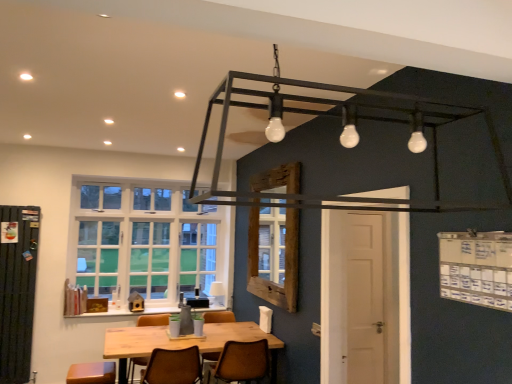
Measure the distance between point (x=509, y=196) and camera.

A distance of 5.02 feet exists between point (x=509, y=196) and camera.

You are a GUI agent. You are given a task and a screenshot of the screen. Output one action in this format:
    pyautogui.click(x=<x>, y=<y>)
    Task: Click on the wooden frame at center, the second window viewed from the left
    This screenshot has height=384, width=512.
    Given the screenshot: What is the action you would take?
    pyautogui.click(x=274, y=255)

Where is `brown leather chair at center, the 2th chair viewed from the right`? This screenshot has height=384, width=512. brown leather chair at center, the 2th chair viewed from the right is located at coordinates (173, 367).

In order to face white glass window at left, which appears as the 1th window when viewed from the back, should I rotate leftwards or rightwards?

Rotate your view left by about 13.865°.

Image resolution: width=512 pixels, height=384 pixels. Find the location of `wooden table at center`. wooden table at center is located at coordinates (182, 342).

Identify the location of metallic black frame at upper center. Image resolution: width=512 pixels, height=384 pixels. (343, 121).

Does white glass window at left, the first window when ordered from left to right, have a greater height compared to metallic black frame at upper center?

Yes.

Is metallic black frame at upper center a part of white glass window at left, which appears as the 1th window when viewed from the back?

No, metallic black frame at upper center is located outside of white glass window at left, which appears as the 1th window when viewed from the back.

From a real-world perspective, does white glass window at left, which appears as the 1th window when viewed from the back, sit lower than metallic black frame at upper center?

Correct, in the physical world, white glass window at left, which appears as the 1th window when viewed from the back, is lower than metallic black frame at upper center.

From the image's perspective, which chair is the 2nd one below the white glass window at left, the 2th window viewed from the front? Please provide its 2D coordinates.

[(241, 362)]

From a real-world perspective, which is physically below, brown leather chair at lower center, which is the second chair in left-to-right order, or white glass window at left, the first window when ordered from left to right?

brown leather chair at lower center, which is the second chair in left-to-right order.

Which is less distant, (230, 350) or (134, 287)?

Positioned in front is point (230, 350).

In the image, is brown leather chair at lower center, which is the second chair in left-to-right order, positioned in front of or behind white glass window at left, arranged as the second window when viewed from the right?

brown leather chair at lower center, which is the second chair in left-to-right order, is positioned closer to the viewer than white glass window at left, arranged as the second window when viewed from the right.

Find the location of a particular element. The image size is (512, 384). table that is under the wooden frame at center, the first window from the right (from a real-world perspective) is located at coordinates (182, 342).

Is wooden frame at center, the second window viewed from the left, wider or thinner than wooden table at center?

Clearly, wooden frame at center, the second window viewed from the left, has less width compared to wooden table at center.

Looking at this image, considering the relative sizes of wooden frame at center, the second window in the back-to-front sequence, and wooden table at center in the image provided, is wooden frame at center, the second window in the back-to-front sequence, taller than wooden table at center?

Indeed, wooden frame at center, the second window in the back-to-front sequence, has a greater height compared to wooden table at center.

From a real-world perspective, is white ceramic lamp at center below metallic black frame at upper center?

Yes.

Considering the positions of points (219, 295) and (257, 197), is point (219, 295) farther from camera compared to point (257, 197)?

Yes, point (219, 295) is farther from viewer.

How many degrees apart are the facing directions of white ceramic lamp at center and metallic black frame at upper center?

The angular difference between white ceramic lamp at center and metallic black frame at upper center is 177 degrees.

Consider the image. From the image's perspective, relative to metallic black frame at upper center, is white ceramic lamp at center above or below?

Based on their image positions, white ceramic lamp at center is located beneath metallic black frame at upper center.

Is white ceramic lamp at center a part of brown leather chair at lower center, marked as the first chair in a right-to-left arrangement?

No, white ceramic lamp at center is not a part of brown leather chair at lower center, marked as the first chair in a right-to-left arrangement.

Between brown leather chair at lower center, which is the second chair in left-to-right order, and white ceramic lamp at center, which one has smaller size?

With smaller size is white ceramic lamp at center.

Are brown leather chair at lower center, which is the second chair in left-to-right order, and white ceramic lamp at center located far from each other?

brown leather chair at lower center, which is the second chair in left-to-right order, is positioned a significant distance from white ceramic lamp at center.

Identify the location of chair that appears on the right of white ceramic lamp at center. (241, 362).

Is white ceramic lamp at center taller or shorter than brown leather chair at lower center, which is the second chair in left-to-right order?

In the image, white ceramic lamp at center appears to be shorter than brown leather chair at lower center, which is the second chair in left-to-right order.

Is white ceramic lamp at center turned away from brown leather chair at lower center, marked as the first chair in a right-to-left arrangement?

white ceramic lamp at center does not have its back to brown leather chair at lower center, marked as the first chair in a right-to-left arrangement.

Can you confirm if white ceramic lamp at center is bigger than brown leather chair at lower center, which is the second chair in left-to-right order?

No, white ceramic lamp at center is not bigger than brown leather chair at lower center, which is the second chair in left-to-right order.

Is metallic black frame at upper center positioned beyond the bounds of brown leather chair at lower center, which is the second chair in left-to-right order?

Yes, metallic black frame at upper center is not within brown leather chair at lower center, which is the second chair in left-to-right order.

Is metallic black frame at upper center aimed at brown leather chair at lower center, which is the second chair in left-to-right order?

No, metallic black frame at upper center is not turned towards brown leather chair at lower center, which is the second chair in left-to-right order.

From a real-world perspective, is metallic black frame at upper center physically located above or below brown leather chair at lower center, which is the second chair in left-to-right order?

From a real-world perspective, metallic black frame at upper center is physically above brown leather chair at lower center, which is the second chair in left-to-right order.

Is metallic black frame at upper center smaller than brown leather chair at lower center, which is the second chair in left-to-right order?

Incorrect, metallic black frame at upper center is not smaller in size than brown leather chair at lower center, which is the second chair in left-to-right order.

Where is `the 2nd window to the left when counting from the metallic black frame at upper center`? This screenshot has height=384, width=512. the 2nd window to the left when counting from the metallic black frame at upper center is located at coordinates (145, 242).

Locate an element on the screen. chair that is the 1st one when counting forward from the white glass window at left, arranged as the second window when viewed from the right is located at coordinates (241, 362).

Looking at the image, which one is located further to white glass window at left, the first window when ordered from left to right, white ceramic lamp at center or brown leather chair at lower center, which is the second chair in left-to-right order?

Among the two, brown leather chair at lower center, which is the second chair in left-to-right order, is located further to white glass window at left, the first window when ordered from left to right.

From the image, which object appears to be farther from wooden table at center, brown leather chair at center, which appears as the 1th chair when viewed from the left, or white glass window at left, the 2th window viewed from the front?

The object further to wooden table at center is white glass window at left, the 2th window viewed from the front.

Considering their positions, is wooden frame at center, the second window in the back-to-front sequence, positioned further to wooden table at center than white ceramic lamp at center?

white ceramic lamp at center is positioned further to the anchor wooden table at center.

Based on their spatial positions, is white glass window at left, the first window when ordered from left to right, or brown leather chair at center, which appears as the 1th chair when viewed from the left, further from wooden table at center?

white glass window at left, the first window when ordered from left to right, lies further to wooden table at center than the other object.

Based on their spatial positions, is brown leather chair at center, which appears as the 1th chair when viewed from the left, or white ceramic lamp at center closer to metallic black frame at upper center?

brown leather chair at center, which appears as the 1th chair when viewed from the left, is positioned closer to the anchor metallic black frame at upper center.

Considering their positions, is white glass window at left, the 2th window viewed from the front, positioned further to brown leather chair at center, the 2th chair viewed from the right, than wooden frame at center, which is the first window from front to back?

white glass window at left, the 2th window viewed from the front, lies further to brown leather chair at center, the 2th chair viewed from the right, than the other object.

Based on their spatial positions, is white ceramic lamp at center or white glass window at left, the first window when ordered from left to right, closer to wooden table at center?

white glass window at left, the first window when ordered from left to right, is positioned closer to the anchor wooden table at center.

Based on their spatial positions, is metallic black frame at upper center or brown leather chair at lower center, marked as the first chair in a right-to-left arrangement, further from wooden frame at center, the first window from the right?

The object further to wooden frame at center, the first window from the right, is metallic black frame at upper center.

You are a GUI agent. You are given a task and a screenshot of the screen. Output one action in this format:
    pyautogui.click(x=<x>, y=<y>)
    Task: Click on the chair between metallic black frame at upper center and brown leather chair at lower center, which is the second chair in left-to-right order, in the front-back direction
    The width and height of the screenshot is (512, 384).
    Given the screenshot: What is the action you would take?
    pyautogui.click(x=173, y=367)

The width and height of the screenshot is (512, 384). What are the coordinates of `window between metallic black frame at upper center and white glass window at left, which appears as the 1th window when viewed from the back, from front to back` in the screenshot? It's located at (274, 255).

The image size is (512, 384). What are the coordinates of `chair located between metallic black frame at upper center and wooden table at center in the depth direction` in the screenshot? It's located at (173, 367).

Find the location of a particular element. This screenshot has width=512, height=384. window between wooden table at center and white glass window at left, arranged as the second window when viewed from the right, in the front-back direction is located at coordinates (274, 255).